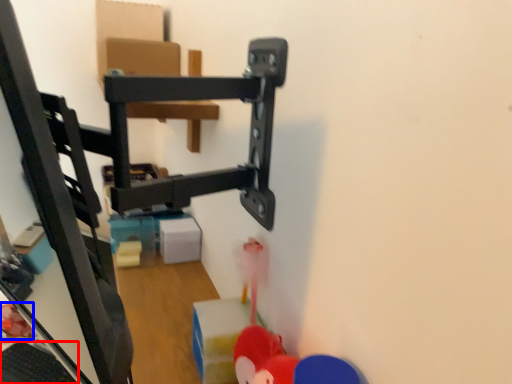
Question: Which of the following is the closest to the observer, keyboard (highlighted by a red box) or toy (highlighted by a blue box)?

Choices:
 (A) keyboard
 (B) toy

Answer: (A)